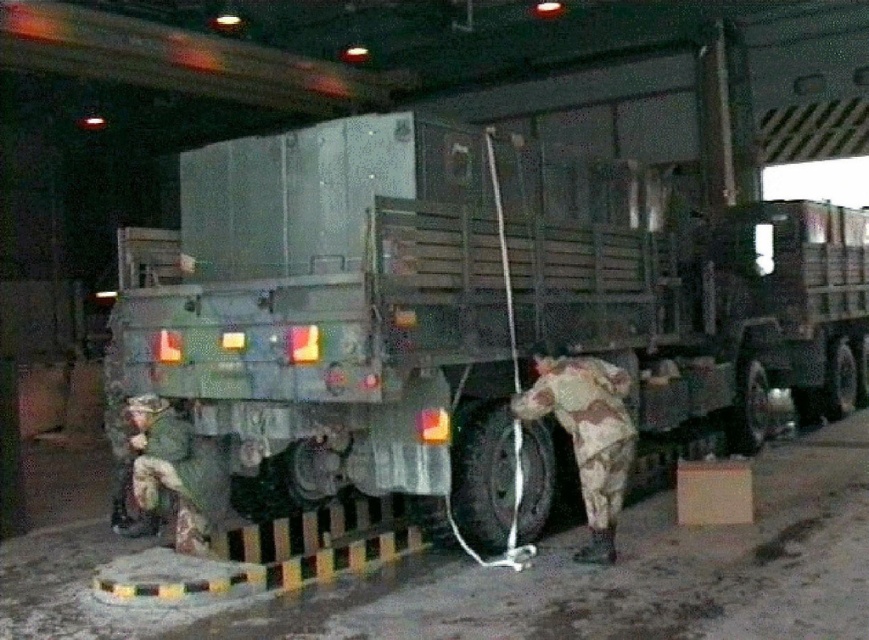
Consider the image. How much distance is there between green matte trailer truck at center and camouflage fabric soldier at lower right?

green matte trailer truck at center is 2.44 meters away from camouflage fabric soldier at lower right.

Does green matte trailer truck at center have a smaller size compared to camouflage fabric soldier at lower right?

Incorrect, green matte trailer truck at center is not smaller in size than camouflage fabric soldier at lower right.

Image resolution: width=869 pixels, height=640 pixels. Describe the element at coordinates (332, 317) in the screenshot. I see `green matte trailer truck at center` at that location.

Where is `green matte trailer truck at center`? The height and width of the screenshot is (640, 869). green matte trailer truck at center is located at coordinates (332, 317).

Describe the element at coordinates (332, 317) in the screenshot. This screenshot has width=869, height=640. I see `green matte trailer truck at center` at that location.

Find the location of a particular element. Image resolution: width=869 pixels, height=640 pixels. green matte trailer truck at center is located at coordinates (332, 317).

Consider the image. Which is above, camouflage fabric soldier at lower right or camouflage fabric soldier at lower left?

Positioned higher is camouflage fabric soldier at lower right.

Is camouflage fabric soldier at lower right to the left of camouflage fabric soldier at lower left from the viewer's perspective?

In fact, camouflage fabric soldier at lower right is to the right of camouflage fabric soldier at lower left.

This screenshot has width=869, height=640. I want to click on camouflage fabric soldier at lower right, so click(587, 435).